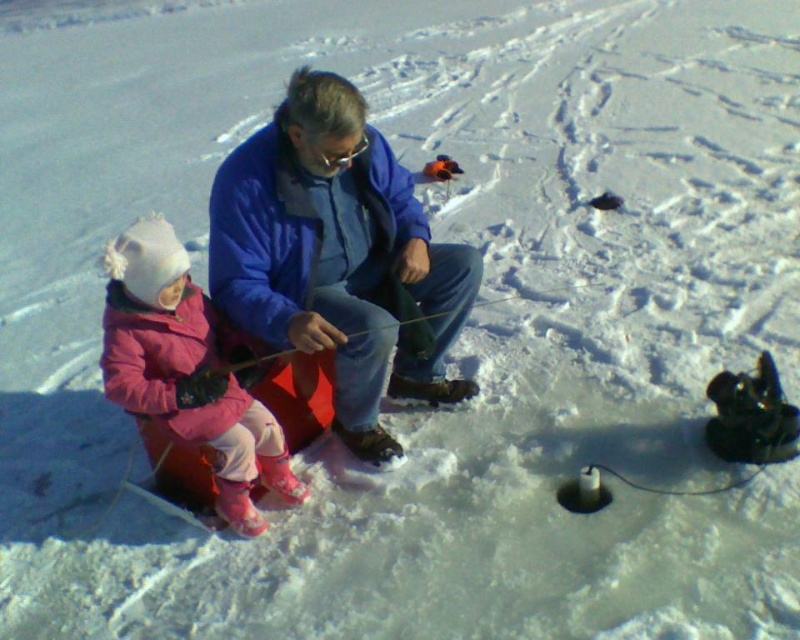
Looking at this image, you are standing in the middle of the frozen lake and see two points marked on the ice. The first point is at coordinates point (416, 371) and the second point is at point (220, 387). Which point is closer to you?

Point (416, 371) is further to the viewer than point (220, 387), so the closer point to you is point (220, 387).

Based on the coordinates provided, where exactly is the blue fabric jacket at center located in the image?

The blue fabric jacket at center is located at coordinates point (x=337, y=257).

You are an observer standing at the edge of the frozen lake. You see the blue fabric jacket at center and the pink fleece jacket at left. Which jacket is positioned higher in the image?

The blue fabric jacket at center is positioned higher in the image than the pink fleece jacket at left.